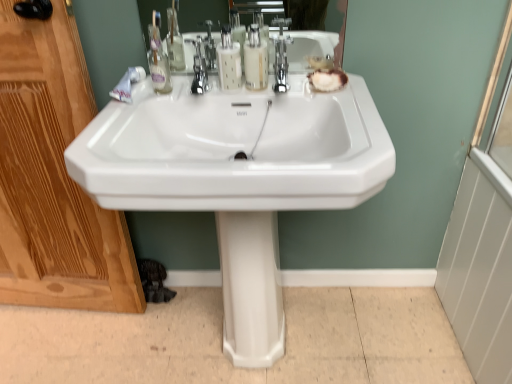
Question: Which direction should I rotate to look at translucent plastic soap dispenser at center, acting as the first soap dispenser starting from the right, — up or down?

Choices:
 (A) up
 (B) down

Answer: (A)

Question: From the image's perspective, does translucent plastic soap dispenser at center, marked as the first soap dispenser in a left-to-right arrangement, appear lower than wooden screen door at left?

Choices:
 (A) yes
 (B) no

Answer: (B)

Question: From a real-world perspective, is translucent plastic soap dispenser at center, which is counted as the second soap dispenser, starting from the right, over wooden screen door at left?

Choices:
 (A) no
 (B) yes

Answer: (B)

Question: Does translucent plastic soap dispenser at center, marked as the first soap dispenser in a left-to-right arrangement, have a larger size compared to wooden screen door at left?

Choices:
 (A) yes
 (B) no

Answer: (B)

Question: Considering the relative positions of translucent plastic soap dispenser at center, marked as the first soap dispenser in a left-to-right arrangement, and wooden screen door at left in the image provided, is translucent plastic soap dispenser at center, marked as the first soap dispenser in a left-to-right arrangement, to the left of wooden screen door at left from the viewer's perspective?

Choices:
 (A) yes
 (B) no

Answer: (B)

Question: Is translucent plastic soap dispenser at center, which is counted as the second soap dispenser, starting from the right, not within wooden screen door at left?

Choices:
 (A) yes
 (B) no

Answer: (A)

Question: From a real-world perspective, is translucent plastic soap dispenser at center, marked as the first soap dispenser in a left-to-right arrangement, physically below wooden screen door at left?

Choices:
 (A) yes
 (B) no

Answer: (B)

Question: Does white glossy sink at center touch polished chrome faucet at center?

Choices:
 (A) no
 (B) yes

Answer: (A)

Question: From the image's perspective, is white glossy sink at center beneath polished chrome faucet at center?

Choices:
 (A) yes
 (B) no

Answer: (A)

Question: From a real-world perspective, is white glossy sink at center under polished chrome faucet at center?

Choices:
 (A) yes
 (B) no

Answer: (A)

Question: From the image's perspective, would you say white glossy sink at center is positioned over polished chrome faucet at center?

Choices:
 (A) yes
 (B) no

Answer: (B)

Question: Would you consider white glossy sink at center to be distant from polished chrome faucet at center?

Choices:
 (A) yes
 (B) no

Answer: (B)

Question: From a real-world perspective, is white glossy sink at center positioned over polished chrome faucet at center based on gravity?

Choices:
 (A) yes
 (B) no

Answer: (B)

Question: Is translucent plastic soap dispenser at center, the 2th soap dispenser positioned from the left, directly adjacent to polished chrome faucet at center?

Choices:
 (A) no
 (B) yes

Answer: (B)